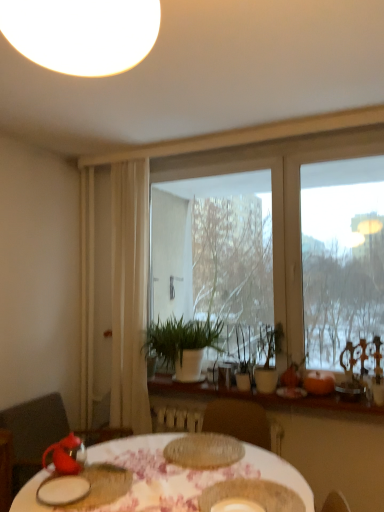
What are the coordinates of `blank space situated above white ceramic plate at lower left, which ranks as the second tableware in left-to-right order (from a real-world perspective)` in the screenshot? It's located at (64, 487).